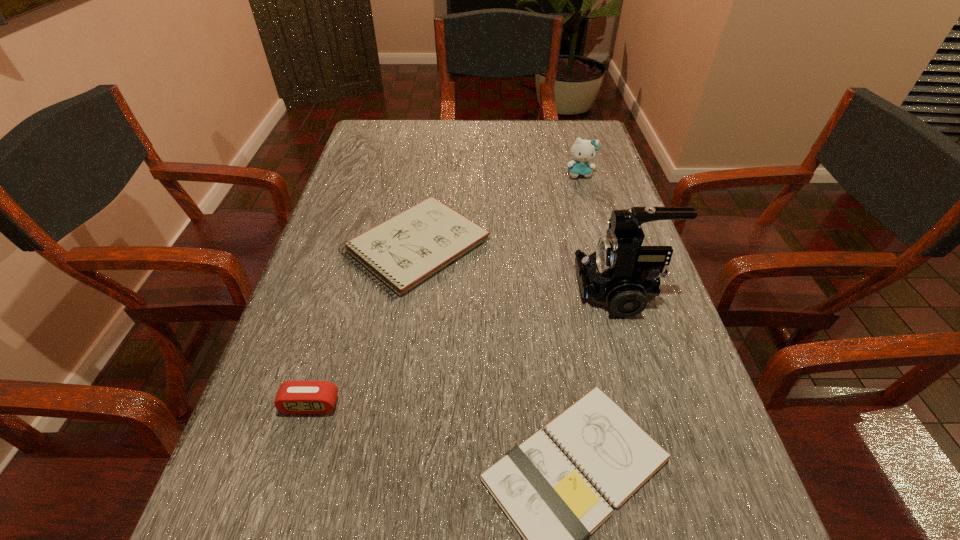
This screenshot has height=540, width=960. In order to click on vacant region located 0.110m on the front-facing side of the alarm clock in this screenshot , I will do `click(287, 484)`.

The width and height of the screenshot is (960, 540). Identify the location of free space located 0.370m on the back of the farther notepad. (434, 134).

You are a GUI agent. You are given a task and a screenshot of the screen. Output one action in this format:
    pyautogui.click(x=<x>, y=<y>)
    Task: Click on the alarm clock at the left edge
    This screenshot has height=540, width=960.
    Given the screenshot: What is the action you would take?
    pyautogui.click(x=294, y=397)

The width and height of the screenshot is (960, 540). What are the coordinates of `notepad that is at the left edge` in the screenshot? It's located at (403, 251).

Locate an element on the screen. The height and width of the screenshot is (540, 960). camcorder present at the right edge is located at coordinates (621, 274).

Locate an element on the screen. The image size is (960, 540). kitten that is at the right edge is located at coordinates (583, 151).

Locate an element on the screen. The height and width of the screenshot is (540, 960). vacant space at the far edge is located at coordinates (540, 129).

I want to click on vacant space at the left edge, so click(323, 341).

At what (x,y) coordinates should I click in order to perform the action: click on vacant region at the right edge of the desktop. Please return your answer as a coordinate pair (x, y). Looking at the image, I should click on (668, 340).

Where is `vacant space at the far left corner`? The height and width of the screenshot is (540, 960). vacant space at the far left corner is located at coordinates (367, 129).